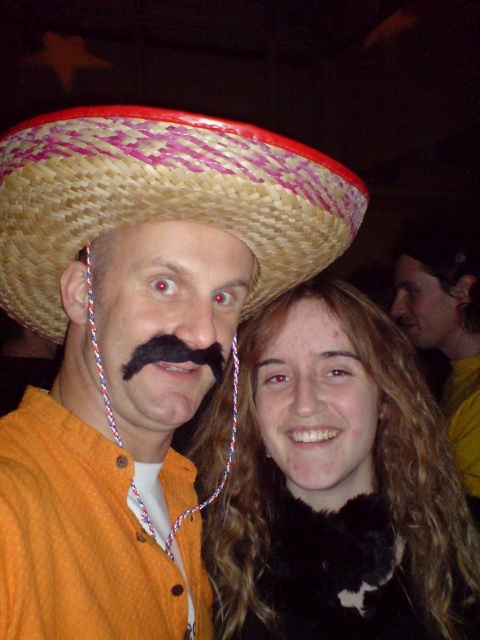
Question: Is black fur coat at center thinner than black fuzzy mustache at center?

Choices:
 (A) no
 (B) yes

Answer: (A)

Question: Can you confirm if woven straw sombrero at upper center is positioned below black fuzzy mustache at center?

Choices:
 (A) no
 (B) yes

Answer: (A)

Question: Which of the following is the farthest from the observer?

Choices:
 (A) woven straw sombrero at upper center
 (B) black fuzzy mustache at center
 (C) black fur coat at center

Answer: (C)

Question: Which of the following is the farthest from the observer?

Choices:
 (A) (43, 268)
 (B) (466, 333)

Answer: (B)

Question: From the image, what is the correct spatial relationship of black fur coat at center in relation to woven straw sombrero at upper center?

Choices:
 (A) above
 (B) below

Answer: (B)

Question: Which point is closer to the camera taking this photo?

Choices:
 (A) (444, 397)
 (B) (227, 632)
 (C) (134, 371)

Answer: (C)